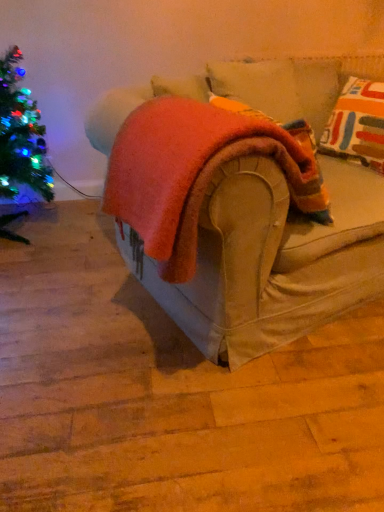
Image resolution: width=384 pixels, height=512 pixels. What do you see at coordinates (195, 172) in the screenshot?
I see `orange fuzzy blanket at center` at bounding box center [195, 172].

The width and height of the screenshot is (384, 512). I want to click on orange fuzzy blanket at center, so click(x=195, y=172).

Where is `orange fuzzy blanket at center`? orange fuzzy blanket at center is located at coordinates (195, 172).